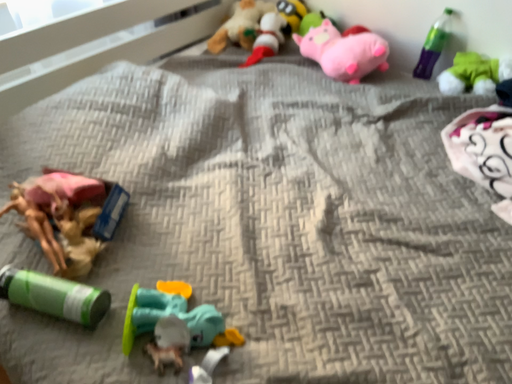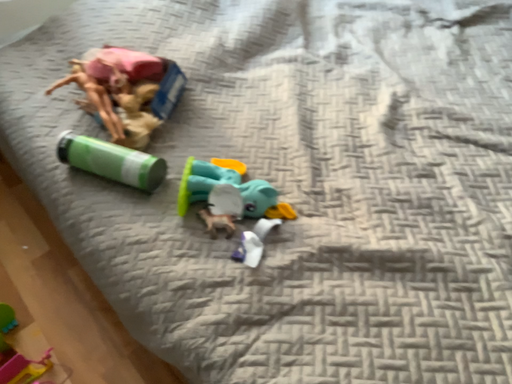
Question: Which way did the camera rotate in the video?

Choices:
 (A) rotated downward
 (B) rotated upward

Answer: (A)